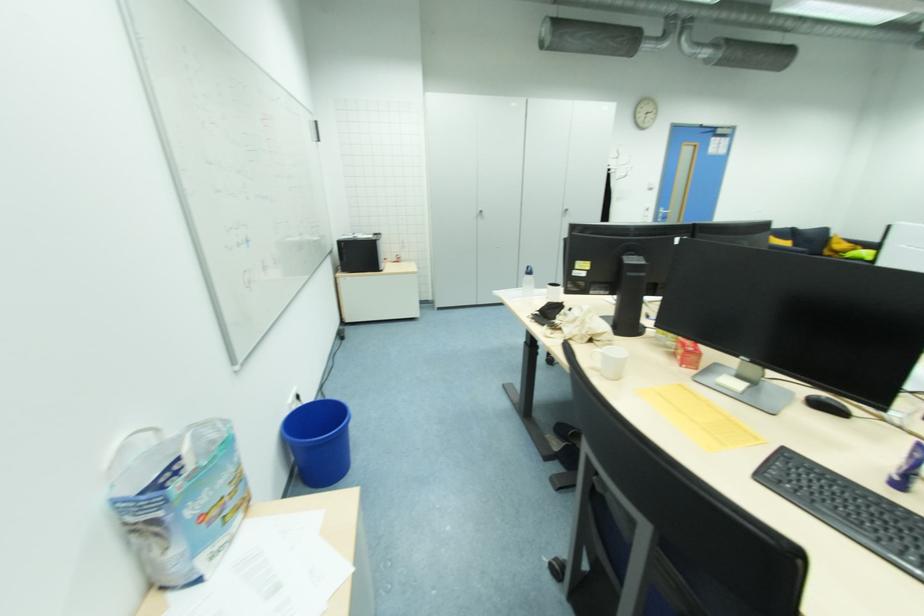
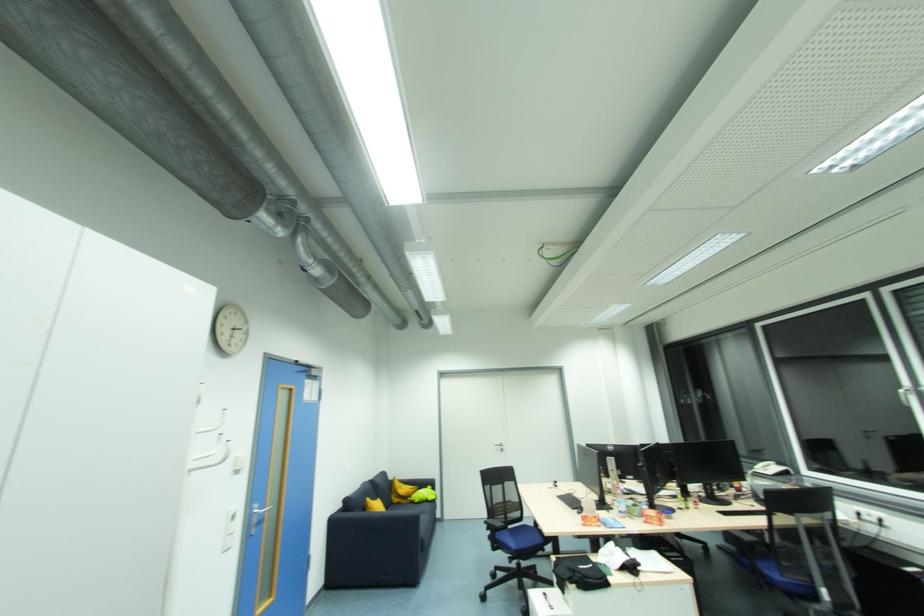
The point at (845,254) is marked in the first image. Where is the corresponding point in the second image?

(412, 499)